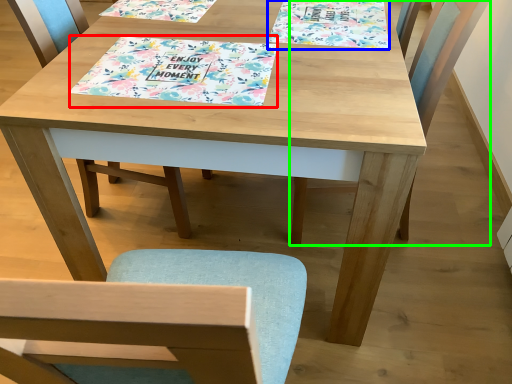
Question: Estimate the real-world distances between objects in this image. Which object is farther from tablecloth (highlighted by a red box), book cover (highlighted by a blue box) or chair (highlighted by a green box)?

Choices:
 (A) book cover
 (B) chair

Answer: (B)